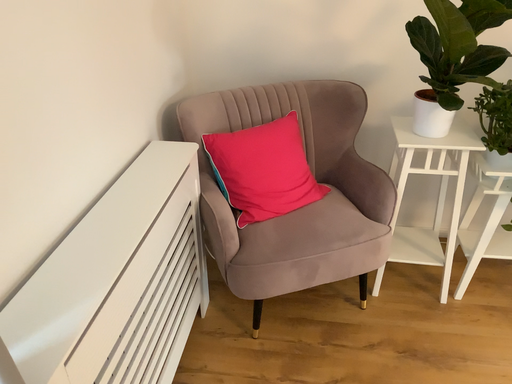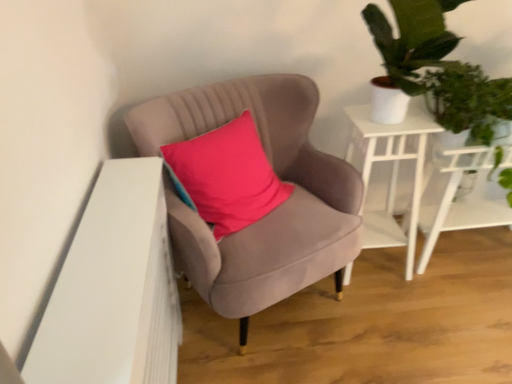
Question: How did the camera likely rotate when shooting the video?

Choices:
 (A) rotated left
 (B) rotated right

Answer: (B)